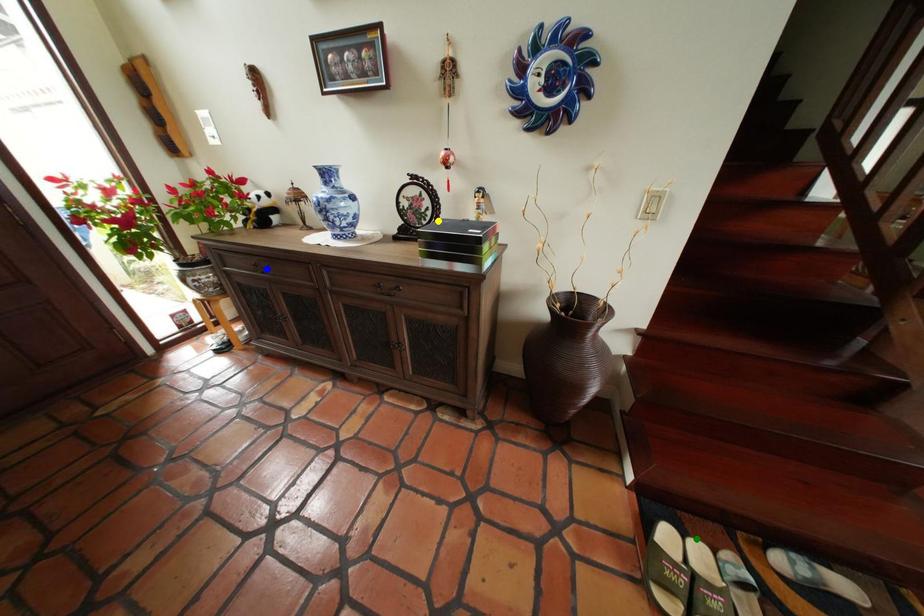
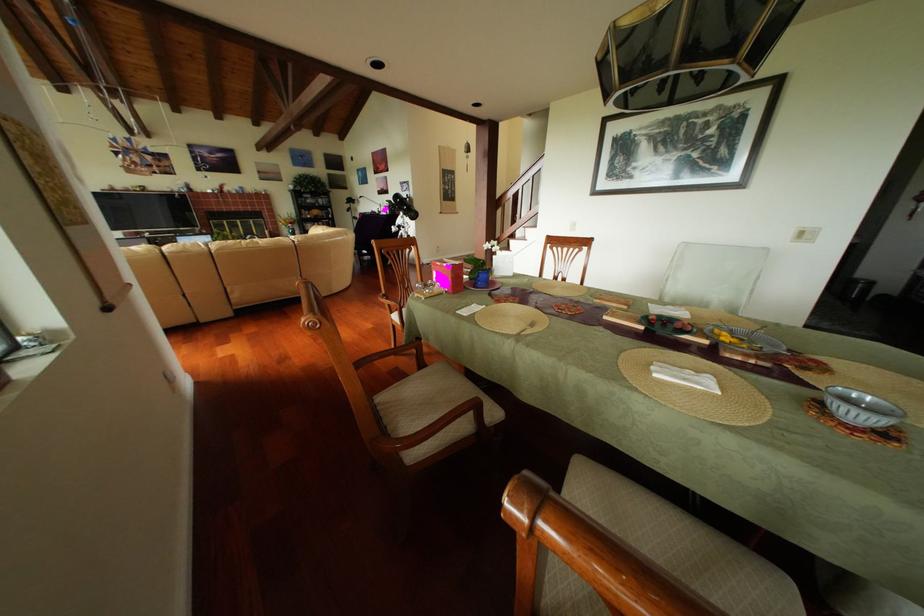
I am providing you with two images of the same scene from different viewpoints. Three points are marked in image1. Which point corresponds to a part or object that is occluded in image2?In image1, three points are marked. Which of them correspond to a part or object that is occluded in image2?Among the three points shown in image1, which one corresponds to a part or object that is no longer visible due to occlusion in image2?

green point, yellow point, blue point cannot be seen in image2.